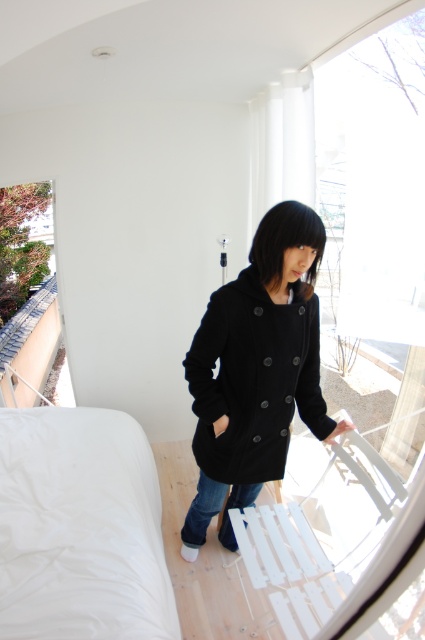
You are standing in the middle of the room and want to move to the white soft bed at lower left. Which direction should you walk to reach it?

Since the white soft bed at lower left is positioned at point (81, 529), you should walk towards the lower left direction to reach it.

You are a delivery person trying to bring a new sofa into the room. The sofa is as wide as the black woolen coat at center. Can you fit the sofa through the doorway without moving the white soft bed at lower left?

The white soft bed at lower left might be wider than the black woolen coat at center. Since the sofa is as wide as the black woolen coat at center, there is a possibility that the bed is wider, so moving it might be necessary to ensure the sofa can pass through the doorway.